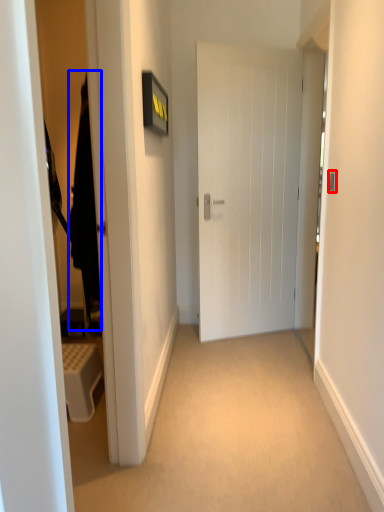
Question: Which object appears farthest to the camera in this image, door handle (highlighted by a red box) or robe (highlighted by a blue box)?

Choices:
 (A) door handle
 (B) robe

Answer: (A)